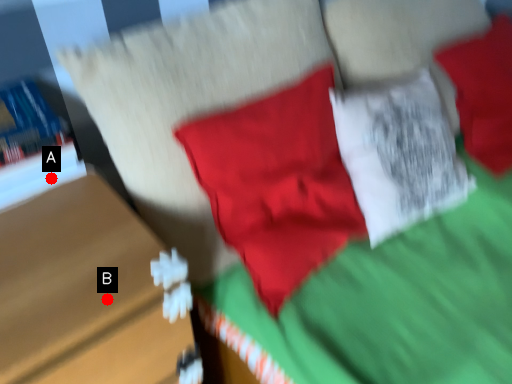
Question: Two points are circled on the image, labeled by A and B beside each circle. Which point is closer to the camera?

Choices:
 (A) A is closer
 (B) B is closer

Answer: (B)